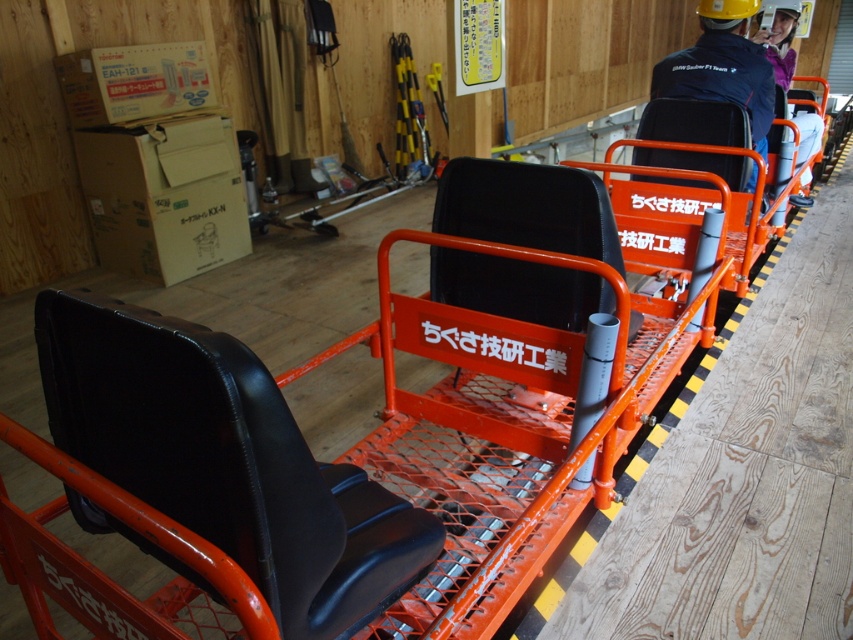
Question: Which point is farther to the camera?

Choices:
 (A) purple fleece jacket at upper right
 (B) black leather jacket at upper right

Answer: (A)

Question: Is black leather jacket at upper right above purple fleece jacket at upper right?

Choices:
 (A) yes
 (B) no

Answer: (B)

Question: Is black leather seat at center below black leather jacket at upper right?

Choices:
 (A) no
 (B) yes

Answer: (B)

Question: Which of the following is the farthest from the observer?

Choices:
 (A) black leather jacket at upper right
 (B) purple fleece jacket at upper right

Answer: (B)

Question: Which of the following is the farthest from the observer?

Choices:
 (A) black leather jacket at upper right
 (B) black leather seat at center
 (C) purple fleece jacket at upper right

Answer: (C)

Question: Can you confirm if black leather seat at center is positioned to the right of black leather jacket at upper right?

Choices:
 (A) no
 (B) yes

Answer: (A)